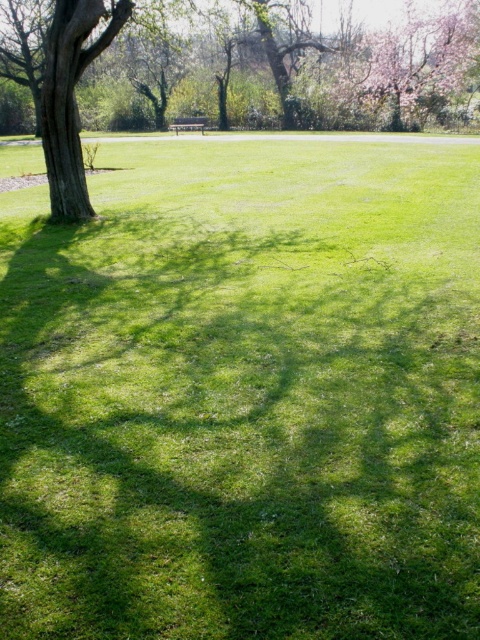
How far apart are green leafy tree at left and wooden park bench at center?

6.85 meters

Can you confirm if green leafy tree at left is smaller than wooden park bench at center?

Actually, green leafy tree at left might be larger than wooden park bench at center.

At what (x,y) coordinates should I click in order to perform the action: click on green leafy tree at left. Please return your answer as a coordinate pair (x, y). The image size is (480, 640). Looking at the image, I should click on (352, 65).